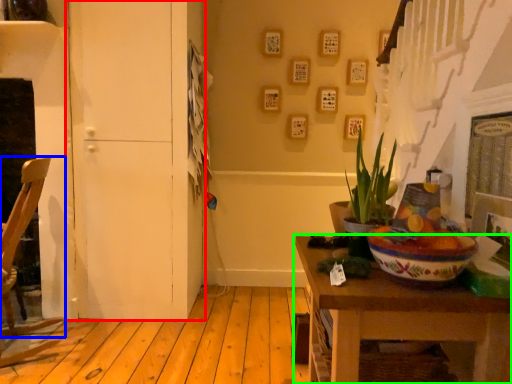
Question: Considering the real-world distances, which object is farthest from door (highlighted by a red box)? chair (highlighted by a blue box) or table (highlighted by a green box)?

Choices:
 (A) chair
 (B) table

Answer: (B)